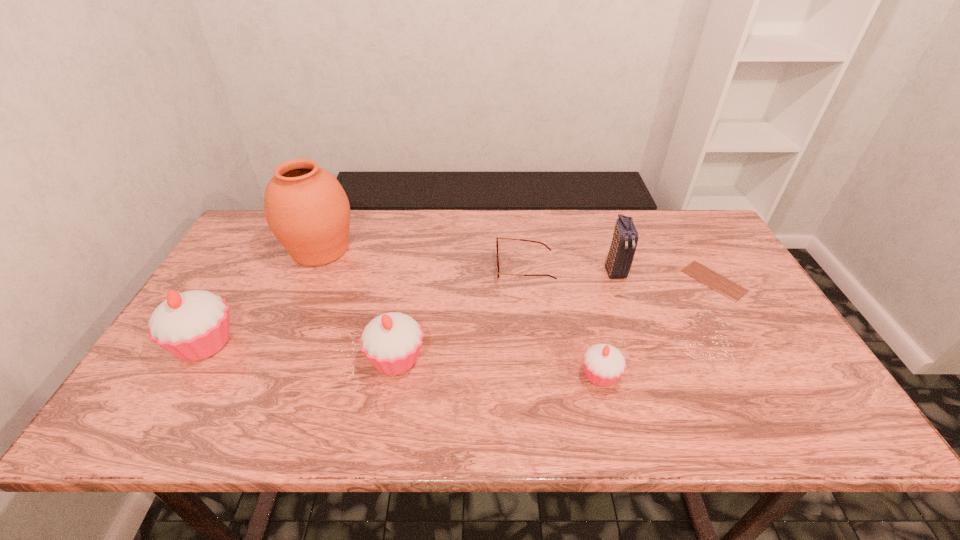
The image size is (960, 540). Identify the location of free space between the fourth shortest object and the fourth object from left to right. (461, 313).

Where is `vacant area that lies between the third object from right to left and the fourth object from left to right`? The height and width of the screenshot is (540, 960). vacant area that lies between the third object from right to left and the fourth object from left to right is located at coordinates click(563, 322).

Find the location of `free space that is in between the clutch bag and the leftmost cupcake`. free space that is in between the clutch bag and the leftmost cupcake is located at coordinates (410, 307).

Locate an element on the screen. This screenshot has width=960, height=540. object that is the second closest one to the urn is located at coordinates coord(392,341).

Identify which object is the second closest to the shortest object. Please provide its 2D coordinates. Your answer should be formatted as a tuple, i.e. [(x, y)], where the tuple contains the x and y coordinates of a point satisfying the conditions above.

[(604, 364)]

Find the location of a particular element. The width and height of the screenshot is (960, 540). the closest cupcake to the urn is located at coordinates (193, 325).

Identify which cupcake is the second closest to the fifth object from left to right. Please provide its 2D coordinates. Your answer should be formatted as a tuple, i.e. [(x, y)], where the tuple contains the x and y coordinates of a point satisfying the conditions above.

[(193, 325)]